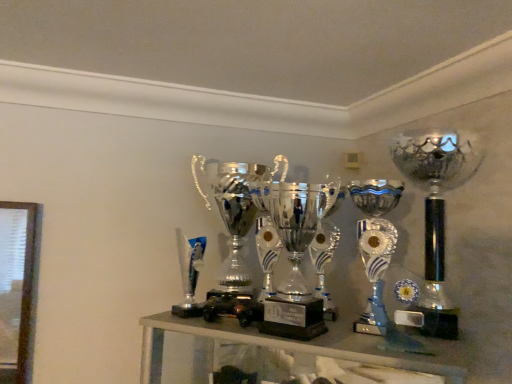
At what (x,y) coordinates should I click in order to perform the action: click on polished silver trophy at center, which is the 3th trophy in right-to-left order. Please return your answer as a coordinate pair (x, y). Looking at the image, I should click on (236, 219).

In terms of height, does silver/metallic trophy at right, acting as the 1th trophy starting from the right, look taller or shorter compared to polished silver trophy at center, which is the 3th trophy in right-to-left order?

Clearly, silver/metallic trophy at right, acting as the 1th trophy starting from the right, is taller compared to polished silver trophy at center, which is the 3th trophy in right-to-left order.

Considering the positions of objects silver/metallic trophy at right, arranged as the 3th trophy when viewed from the left, and polished silver trophy at center, positioned as the 1th trophy in left-to-right order, in the image provided, who is more to the left, silver/metallic trophy at right, arranged as the 3th trophy when viewed from the left, or polished silver trophy at center, positioned as the 1th trophy in left-to-right order,?

From the viewer's perspective, polished silver trophy at center, positioned as the 1th trophy in left-to-right order, appears more on the left side.

Is silver/metallic trophy at right, acting as the 1th trophy starting from the right, positioned with its back to polished silver trophy at center, positioned as the 1th trophy in left-to-right order?

No, polished silver trophy at center, positioned as the 1th trophy in left-to-right order, is not at the back of silver/metallic trophy at right, acting as the 1th trophy starting from the right.

Is shiny silver trophy at center, positioned as the 2th trophy in right-to-left order, looking in the opposite direction of polished silver trophy at center, positioned as the 1th trophy in left-to-right order?

No, shiny silver trophy at center, positioned as the 2th trophy in right-to-left order, is not facing away from polished silver trophy at center, positioned as the 1th trophy in left-to-right order.

Can you see shiny silver trophy at center, positioned as the 2th trophy in right-to-left order, touching polished silver trophy at center, which is the 3th trophy in right-to-left order?

No, shiny silver trophy at center, positioned as the 2th trophy in right-to-left order, is not in contact with polished silver trophy at center, which is the 3th trophy in right-to-left order.

Is shiny silver trophy at center, positioned as the 2th trophy in right-to-left order, at the right side of polished silver trophy at center, which is the 3th trophy in right-to-left order?

Yes, shiny silver trophy at center, positioned as the 2th trophy in right-to-left order, is to the right of polished silver trophy at center, which is the 3th trophy in right-to-left order.

Can you confirm if shiny silver trophy at center, positioned as the 2th trophy in right-to-left order, is smaller than polished silver trophy at center, which is the 3th trophy in right-to-left order?

Indeed, shiny silver trophy at center, positioned as the 2th trophy in right-to-left order, has a smaller size compared to polished silver trophy at center, which is the 3th trophy in right-to-left order.

Does silver/metallic trophy at right, arranged as the 3th trophy when viewed from the left, turn towards shiny silver trophy at center, positioned as the 2th trophy in right-to-left order?

No, silver/metallic trophy at right, arranged as the 3th trophy when viewed from the left, is not oriented towards shiny silver trophy at center, positioned as the 2th trophy in right-to-left order.

From a real-world perspective, which object stands above the other?

silver/metallic trophy at right, acting as the 1th trophy starting from the right, from a real-world perspective.

Which object is further away from the camera taking this photo, silver/metallic trophy at right, acting as the 1th trophy starting from the right, or shiny silver trophy at center, positioned as the 2th trophy in right-to-left order?

silver/metallic trophy at right, acting as the 1th trophy starting from the right, is further from the camera.

Considering the relative sizes of polished silver trophy at center, which is the 3th trophy in right-to-left order, and silver/metallic trophy at right, acting as the 1th trophy starting from the right, in the image provided, is polished silver trophy at center, which is the 3th trophy in right-to-left order, wider than silver/metallic trophy at right, acting as the 1th trophy starting from the right,?

In fact, polished silver trophy at center, which is the 3th trophy in right-to-left order, might be narrower than silver/metallic trophy at right, acting as the 1th trophy starting from the right.

The height and width of the screenshot is (384, 512). What are the coordinates of `trophy above the polished silver trophy at center, positioned as the 1th trophy in left-to-right order (from the image's perspective)` in the screenshot? It's located at (436, 210).

Is polished silver trophy at center, which is the 3th trophy in right-to-left order, to the left of silver/metallic trophy at right, arranged as the 3th trophy when viewed from the left, from the viewer's perspective?

Yes, polished silver trophy at center, which is the 3th trophy in right-to-left order, is to the left of silver/metallic trophy at right, arranged as the 3th trophy when viewed from the left.

Does point (230, 229) appear closer or farther from the camera than point (433, 298)?

Point (230, 229) appears to be farther away from the viewer than point (433, 298).

Who is smaller, polished silver trophy at center, which is the 3th trophy in right-to-left order, or shiny silver trophy at center, which is the second trophy in left-to-right order?

With smaller size is shiny silver trophy at center, which is the second trophy in left-to-right order.

Does polished silver trophy at center, which is the 3th trophy in right-to-left order, turn towards shiny silver trophy at center, which is the second trophy in left-to-right order?

No, polished silver trophy at center, which is the 3th trophy in right-to-left order, is not turned towards shiny silver trophy at center, which is the second trophy in left-to-right order.

Can silver/metallic trophy at right, acting as the 1th trophy starting from the right, be found inside shiny silver trophy at center, which is the second trophy in left-to-right order?

No, silver/metallic trophy at right, acting as the 1th trophy starting from the right, is located outside of shiny silver trophy at center, which is the second trophy in left-to-right order.

This screenshot has height=384, width=512. Find the location of `trophy in front of the silver/metallic trophy at right, arranged as the 3th trophy when viewed from the left`. trophy in front of the silver/metallic trophy at right, arranged as the 3th trophy when viewed from the left is located at coordinates (375, 239).

Is point (384, 238) positioned before point (417, 167)?

Yes, point (384, 238) is in front of point (417, 167).

Does shiny silver trophy at center, which is the second trophy in left-to-right order, touch silver/metallic trophy at right, arranged as the 3th trophy when viewed from the left?

No, shiny silver trophy at center, which is the second trophy in left-to-right order, is not with silver/metallic trophy at right, arranged as the 3th trophy when viewed from the left.

Find the location of a particular element. The height and width of the screenshot is (384, 512). trophy that is the 1st object directly below the silver/metallic trophy at right, acting as the 1th trophy starting from the right (from a real-world perspective) is located at coordinates (236, 219).

Starting from the shiny silver trophy at center, positioned as the 2th trophy in right-to-left order, which trophy is the 2nd one behind? Please provide its 2D coordinates.

[(236, 219)]

Based on their spatial positions, is polished silver trophy at center, positioned as the 1th trophy in left-to-right order, or silver/metallic trophy at right, arranged as the 3th trophy when viewed from the left, closer to shiny silver trophy at center, which is the second trophy in left-to-right order?

silver/metallic trophy at right, arranged as the 3th trophy when viewed from the left, lies closer to shiny silver trophy at center, which is the second trophy in left-to-right order, than the other object.

Which object lies nearer to the anchor point shiny silver trophy at center, which is the second trophy in left-to-right order, silver/metallic trophy at right, arranged as the 3th trophy when viewed from the left, or polished silver trophy at center, positioned as the 1th trophy in left-to-right order?

silver/metallic trophy at right, arranged as the 3th trophy when viewed from the left, lies closer to shiny silver trophy at center, which is the second trophy in left-to-right order, than the other object.

Looking at the image, which one is located further to polished silver trophy at center, which is the 3th trophy in right-to-left order, silver/metallic trophy at right, acting as the 1th trophy starting from the right, or shiny silver trophy at center, positioned as the 2th trophy in right-to-left order?

Based on the image, silver/metallic trophy at right, acting as the 1th trophy starting from the right, appears to be further to polished silver trophy at center, which is the 3th trophy in right-to-left order.

When comparing their distances from silver/metallic trophy at right, arranged as the 3th trophy when viewed from the left, does shiny silver trophy at center, which is the second trophy in left-to-right order, or polished silver trophy at center, positioned as the 1th trophy in left-to-right order, seem further?

polished silver trophy at center, positioned as the 1th trophy in left-to-right order, is positioned further to the anchor silver/metallic trophy at right, arranged as the 3th trophy when viewed from the left.

Which object lies further to the anchor point silver/metallic trophy at right, acting as the 1th trophy starting from the right, polished silver trophy at center, which is the 3th trophy in right-to-left order, or shiny silver trophy at center, which is the second trophy in left-to-right order?

polished silver trophy at center, which is the 3th trophy in right-to-left order.

Which object lies further to the anchor point polished silver trophy at center, positioned as the 1th trophy in left-to-right order, shiny silver trophy at center, which is the second trophy in left-to-right order, or silver/metallic trophy at right, acting as the 1th trophy starting from the right?

Based on the image, silver/metallic trophy at right, acting as the 1th trophy starting from the right, appears to be further to polished silver trophy at center, positioned as the 1th trophy in left-to-right order.

Locate an element on the screen. The height and width of the screenshot is (384, 512). trophy located between polished silver trophy at center, which is the 3th trophy in right-to-left order, and silver/metallic trophy at right, arranged as the 3th trophy when viewed from the left, in the left-right direction is located at coordinates (375, 239).